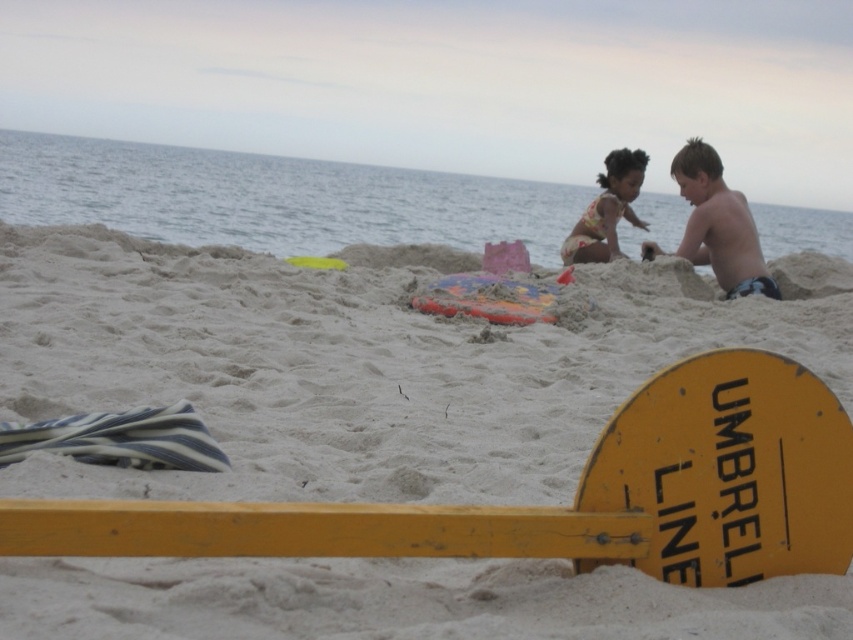
Question: Which object is the closest to the light brown skin at upper right?

Choices:
 (A) white sand at center
 (B) floral swimsuit at center

Answer: (B)

Question: Can you confirm if white sand at center is bigger than light brown skin at upper right?

Choices:
 (A) no
 (B) yes

Answer: (B)

Question: Among these points, which one is nearest to the camera?

Choices:
 (A) coord(10,314)
 (B) coord(618,256)

Answer: (A)

Question: Is light brown skin at upper right closer to the viewer compared to floral swimsuit at center?

Choices:
 (A) yes
 (B) no

Answer: (A)

Question: Which is nearer to the white sand at center?

Choices:
 (A) floral swimsuit at center
 (B) light brown skin at upper right

Answer: (B)

Question: Does white sand at center lie behind floral swimsuit at center?

Choices:
 (A) no
 (B) yes

Answer: (A)